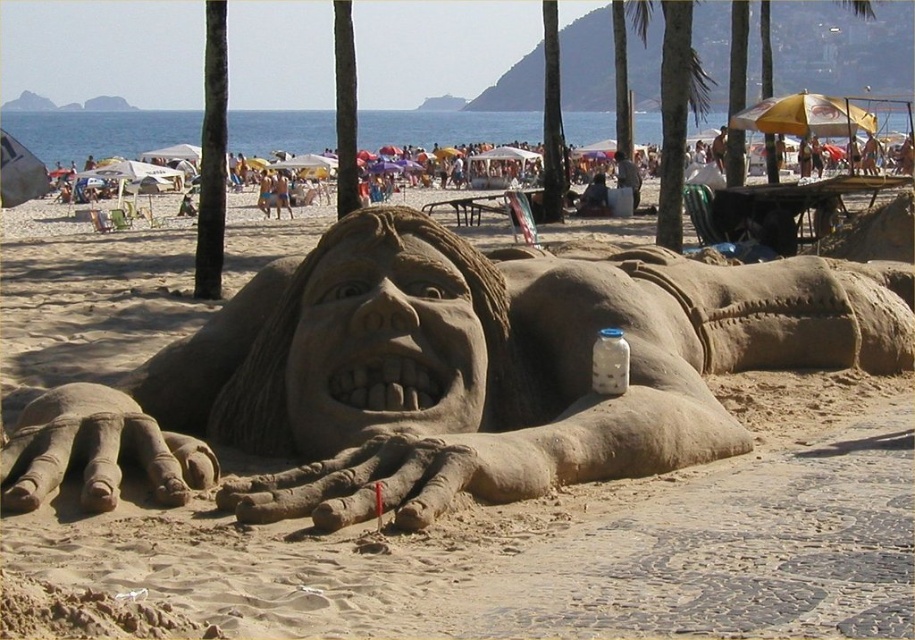
You are standing on the beach and see two points marked in the image. The first point is at coordinate point (124, 401) and the second is at point (707, 100). Which point is closer to you?

Point (124, 401) is in front of point (707, 100), so the first point is closer to you.

You are a photographer trying to capture a shot of the transparent glass bottle at center without the green leafy palm tree at upper center blocking it. Where should you position yourself relative to the bottle?

Move to the left side of the transparent glass bottle at center so that the green leafy palm tree at upper center is to your right and won not block the view.